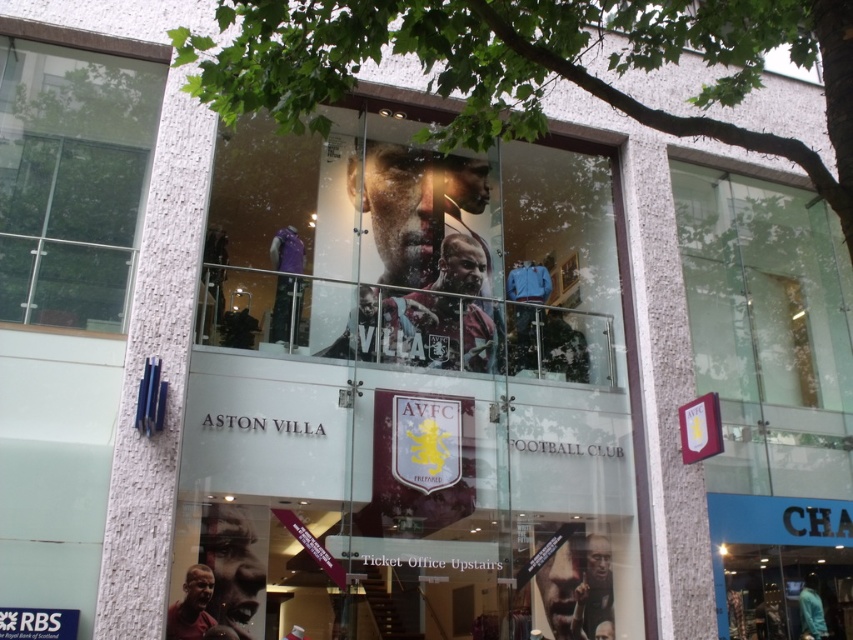
Can you confirm if matte glass poster at center is positioned to the right of smooth skin face at lower left?

Yes, matte glass poster at center is to the right of smooth skin face at lower left.

Does matte glass poster at center lie behind smooth skin face at lower left?

That is False.

Measure the distance between matte glass poster at center and camera.

matte glass poster at center is 5.10 meters away from camera.

Identify the location of matte glass poster at center. (413, 250).

The image size is (853, 640). Describe the element at coordinates (413, 250) in the screenshot. I see `matte glass poster at center` at that location.

Describe the element at coordinates (413, 250) in the screenshot. I see `matte glass poster at center` at that location.

You are a GUI agent. You are given a task and a screenshot of the screen. Output one action in this format:
    pyautogui.click(x=<x>, y=<y>)
    Task: Click on the matte glass poster at center
    The width and height of the screenshot is (853, 640).
    Given the screenshot: What is the action you would take?
    pyautogui.click(x=413, y=250)

Which is in front, point (610, 608) or point (183, 588)?

Positioned in front is point (183, 588).

Which is above, matte black jacket at lower right or maroon jersey at lower left?

maroon jersey at lower left is above.

Describe the element at coordinates (593, 592) in the screenshot. I see `matte black jacket at lower right` at that location.

This screenshot has width=853, height=640. Find the location of `matte black jacket at lower right`. matte black jacket at lower right is located at coordinates (593, 592).